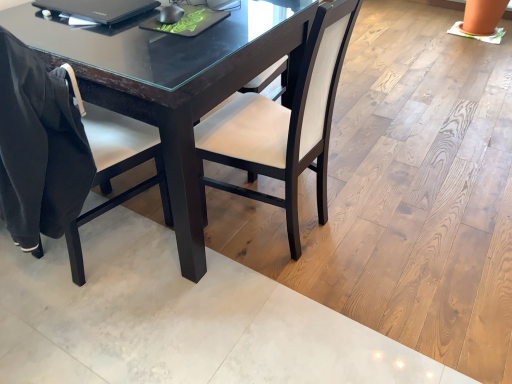
Question: Should I look upward or downward to see satin white chair at center, which is the first chair from right to left?

Choices:
 (A) up
 (B) down

Answer: (A)

Question: Is black matte chair at left, placed as the first chair when sorted from left to right, outside satin white chair at center, the 2th chair viewed from the left?

Choices:
 (A) no
 (B) yes

Answer: (B)

Question: Does black matte chair at left, placed as the first chair when sorted from left to right, come in front of satin white chair at center, which is the first chair from right to left?

Choices:
 (A) yes
 (B) no

Answer: (A)

Question: Does black matte chair at left, placed as the first chair when sorted from left to right, have a larger size compared to satin white chair at center, the 2th chair viewed from the left?

Choices:
 (A) no
 (B) yes

Answer: (B)

Question: From the image's perspective, is black matte chair at left, the 2th chair in the right-to-left sequence, located above satin white chair at center, which is the first chair from right to left?

Choices:
 (A) no
 (B) yes

Answer: (A)

Question: Considering the relative sizes of black matte chair at left, placed as the first chair when sorted from left to right, and satin white chair at center, which is the first chair from right to left, in the image provided, is black matte chair at left, placed as the first chair when sorted from left to right, thinner than satin white chair at center, which is the first chair from right to left,?

Choices:
 (A) yes
 (B) no

Answer: (B)

Question: Can you confirm if black matte chair at left, placed as the first chair when sorted from left to right, is positioned to the right of satin white chair at center, the 2th chair viewed from the left?

Choices:
 (A) no
 (B) yes

Answer: (A)

Question: Is satin white chair at center, which is the first chair from right to left, not within black matte chair at left, placed as the first chair when sorted from left to right?

Choices:
 (A) yes
 (B) no

Answer: (A)

Question: From a real-world perspective, is satin white chair at center, the 2th chair viewed from the left, located beneath black matte chair at left, placed as the first chair when sorted from left to right?

Choices:
 (A) no
 (B) yes

Answer: (B)

Question: Is satin white chair at center, which is the first chair from right to left, smaller than black matte chair at left, placed as the first chair when sorted from left to right?

Choices:
 (A) yes
 (B) no

Answer: (A)

Question: Is satin white chair at center, which is the first chair from right to left, wider than black matte chair at left, placed as the first chair when sorted from left to right?

Choices:
 (A) no
 (B) yes

Answer: (A)

Question: Is satin white chair at center, which is the first chair from right to left, turned away from black matte chair at left, the 2th chair in the right-to-left sequence?

Choices:
 (A) yes
 (B) no

Answer: (B)

Question: Is satin white chair at center, the 2th chair viewed from the left, positioned behind black matte chair at left, the 2th chair in the right-to-left sequence?

Choices:
 (A) yes
 (B) no

Answer: (A)

Question: From the image's perspective, is black glossy laptop at upper left above satin white chair at center, which is the first chair from right to left?

Choices:
 (A) no
 (B) yes

Answer: (B)